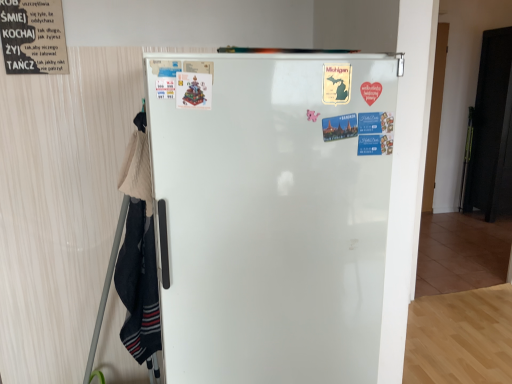
Question: Is black paper poster at upper left, positioned as the second poster in front-to-back order, at the back of white glossy refrigerator at center?

Choices:
 (A) yes
 (B) no

Answer: (B)

Question: Considering the relative positions of white glossy refrigerator at center and black paper poster at upper left, the second poster positioned from the bottom, in the image provided, is white glossy refrigerator at center to the left of black paper poster at upper left, the second poster positioned from the bottom, from the viewer's perspective?

Choices:
 (A) no
 (B) yes

Answer: (A)

Question: Would you say white glossy refrigerator at center is outside black paper poster at upper left, arranged as the first poster when viewed from the top?

Choices:
 (A) no
 (B) yes

Answer: (B)

Question: Could you tell me if white glossy refrigerator at center is turned towards black paper poster at upper left, the second poster positioned from the bottom?

Choices:
 (A) yes
 (B) no

Answer: (B)

Question: Does white glossy refrigerator at center have a greater height compared to black paper poster at upper left, which is the first poster in left-to-right order?

Choices:
 (A) no
 (B) yes

Answer: (B)

Question: Does white glossy refrigerator at center have a lesser height compared to black paper poster at upper left, the 1th poster in the back-to-front sequence?

Choices:
 (A) no
 (B) yes

Answer: (A)

Question: Are matte plastic poster at center, which is the 2th poster in back-to-front order, and white glossy refrigerator at center beside each other?

Choices:
 (A) yes
 (B) no

Answer: (B)

Question: From a real-world perspective, is matte plastic poster at center, positioned as the first poster in bottom-to-top order, under white glossy refrigerator at center?

Choices:
 (A) yes
 (B) no

Answer: (B)

Question: Is matte plastic poster at center, which is the 2th poster in back-to-front order, looking in the opposite direction of white glossy refrigerator at center?

Choices:
 (A) no
 (B) yes

Answer: (B)

Question: Can you confirm if matte plastic poster at center, positioned as the first poster in bottom-to-top order, is thinner than white glossy refrigerator at center?

Choices:
 (A) yes
 (B) no

Answer: (A)

Question: Considering the relative sizes of matte plastic poster at center, positioned as the first poster in bottom-to-top order, and white glossy refrigerator at center in the image provided, is matte plastic poster at center, positioned as the first poster in bottom-to-top order, bigger than white glossy refrigerator at center?

Choices:
 (A) yes
 (B) no

Answer: (B)

Question: Considering the relative positions of matte plastic poster at center, which is counted as the first poster, starting from the front, and white glossy refrigerator at center in the image provided, is matte plastic poster at center, which is counted as the first poster, starting from the front, to the left of white glossy refrigerator at center from the viewer's perspective?

Choices:
 (A) yes
 (B) no

Answer: (A)

Question: Is black matte door at right closer to camera compared to matte plastic poster at center, the second poster positioned from the top?

Choices:
 (A) no
 (B) yes

Answer: (A)